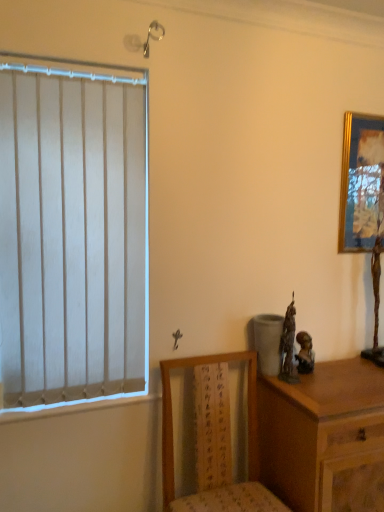
The width and height of the screenshot is (384, 512). I want to click on free space in front of matte bronze statue at right, so click(x=327, y=384).